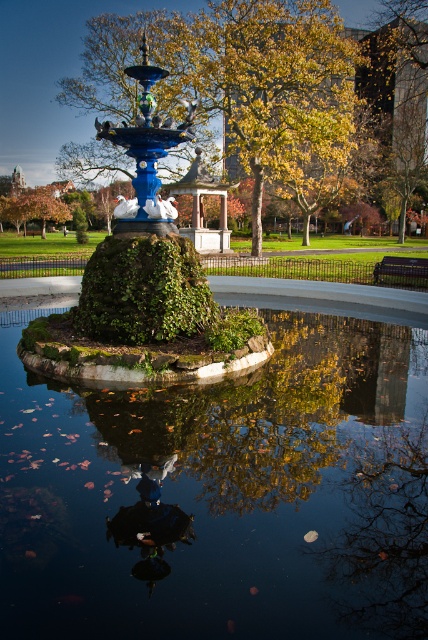
You are a park visitor standing at the edge of the reflective pool. You want to take a photo of both the green leafy tree at center and the blue glossy fountain at center in the same frame. Which object should you focus on first to ensure both are in the frame?

The green leafy tree at center is much taller than the blue glossy fountain at center, so you should focus on the green leafy tree at center first to ensure its full height is captured while still including the blue glossy fountain at center in the frame.

Based on the photo, you are standing at the center of the park and see the point marked as point (237, 77). What object does this point correspond to?

The point (237, 77) corresponds to the green leafy tree at center.